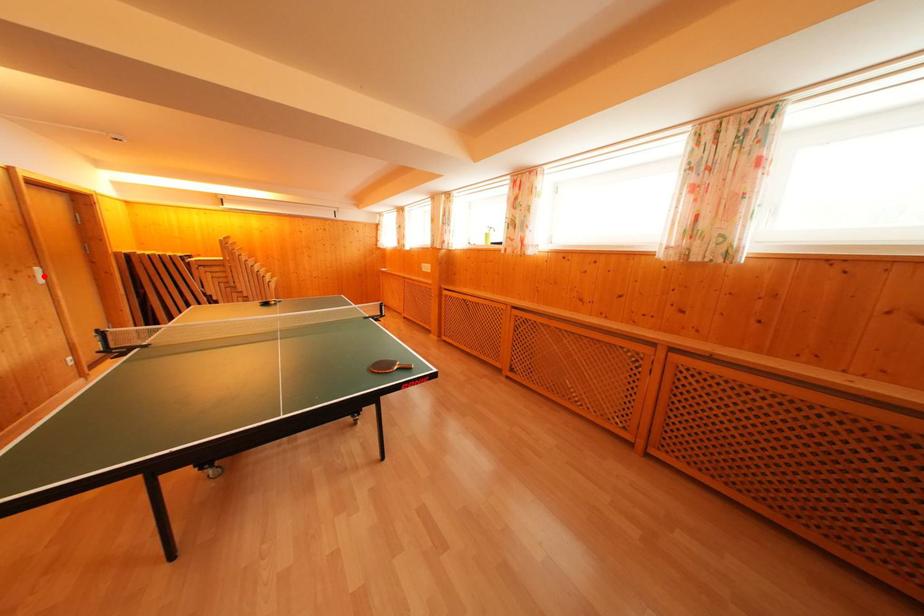
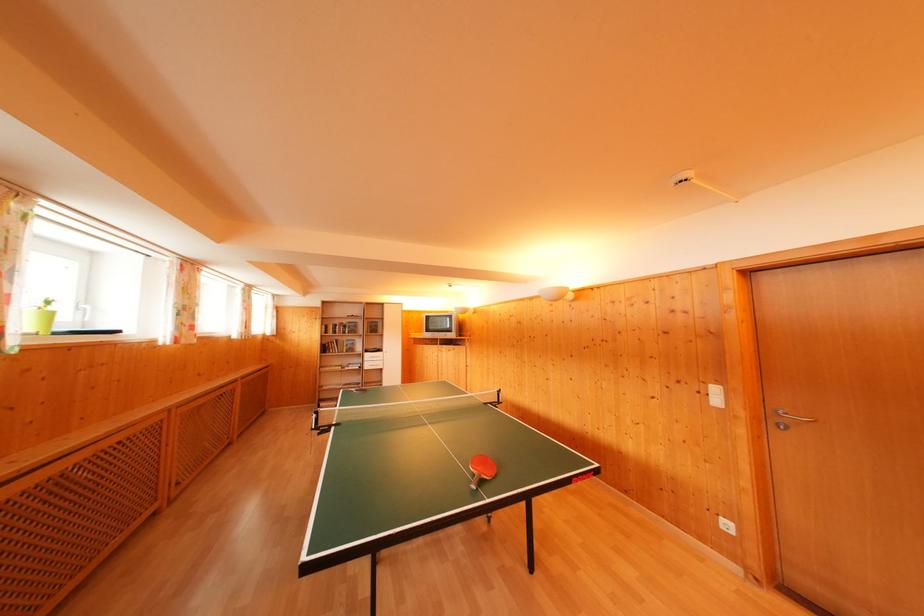
Where in the second image is the point corresponding to the highlighted location from the first image?

(721, 395)